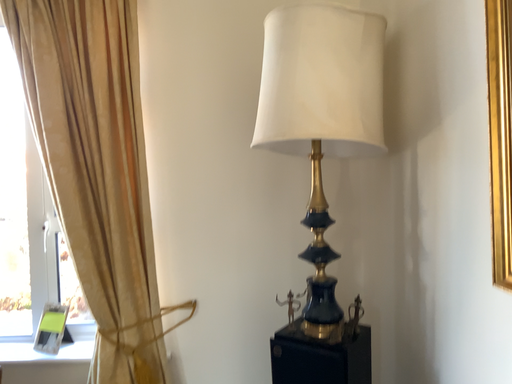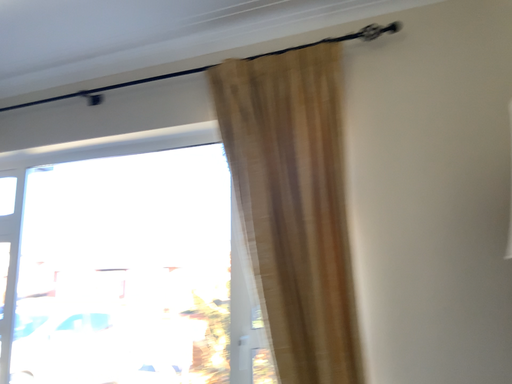
Question: Which way did the camera rotate in the video?

Choices:
 (A) rotated upward
 (B) rotated downward

Answer: (A)